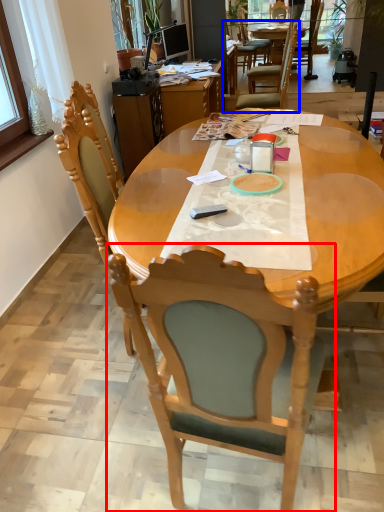
Question: Among these objects, which one is nearest to the camera, chair (highlighted by a red box) or chair (highlighted by a blue box)?

Choices:
 (A) chair
 (B) chair

Answer: (A)